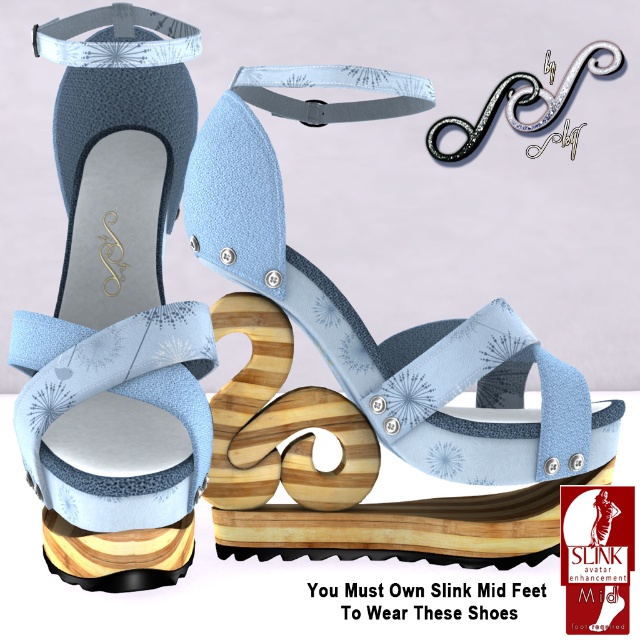
Which is below, light blue suede sandal at center or satin silver strap at upper center?

Positioned lower is light blue suede sandal at center.

Is light blue suede sandal at center thinner than satin silver strap at upper center?

No, light blue suede sandal at center is not thinner than satin silver strap at upper center.

Does point (202, 189) come in front of point (529, 74)?

Yes, it is.

What are the coordinates of `light blue suede sandal at center` in the screenshot? It's located at (392, 358).

Is light blue fabric strap at upper center wider than satin silver strap at upper center?

In fact, light blue fabric strap at upper center might be narrower than satin silver strap at upper center.

Between point (300, 77) and point (456, 124), which one is positioned in front?

Point (300, 77)

Identify the location of light blue fabric strap at upper center. The width and height of the screenshot is (640, 640). (332, 86).

Which is above, white textured fabric strap at upper left or satin silver strap at upper center?

Positioned higher is satin silver strap at upper center.

Is white textured fabric strap at upper left smaller than satin silver strap at upper center?

Actually, white textured fabric strap at upper left might be larger than satin silver strap at upper center.

Between point (160, 28) and point (428, 148), which one is positioned in front?

Positioned in front is point (160, 28).

The width and height of the screenshot is (640, 640). Find the location of `white textured fabric strap at upper left`. white textured fabric strap at upper left is located at coordinates (116, 38).